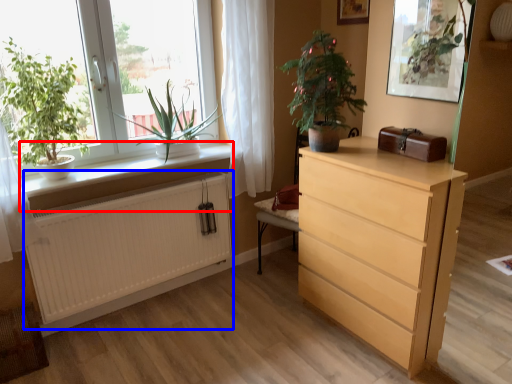
Question: Which object appears farthest to the camera in this image, window sill (highlighted by a red box) or radiator (highlighted by a blue box)?

Choices:
 (A) window sill
 (B) radiator

Answer: (B)